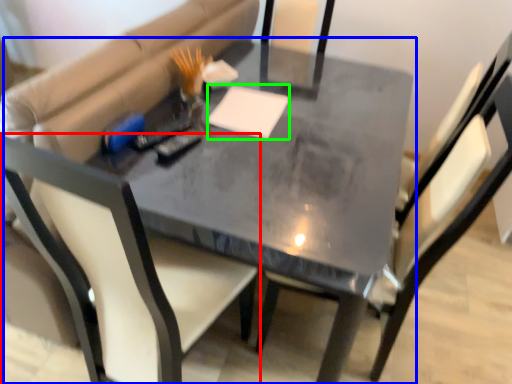
Question: Estimate the real-world distances between objects in this image. Which object is farther from chair (highlighted by a red box), table (highlighted by a blue box) or notepad (highlighted by a green box)?

Choices:
 (A) table
 (B) notepad

Answer: (B)